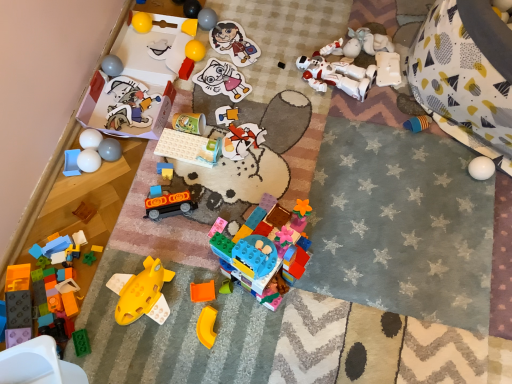
Identify the location of vacant space positioned to the left of white glossy ball at left, marked as the fifth toy in a left-to-right arrangement. Image resolution: width=512 pixels, height=384 pixels. (61, 173).